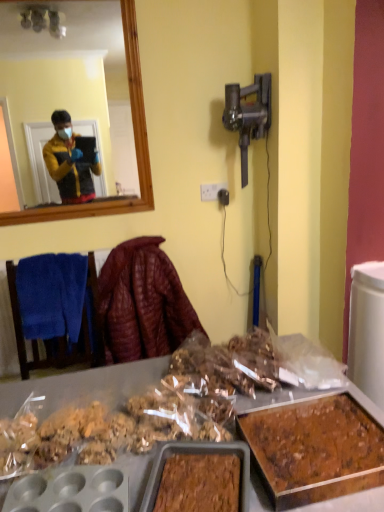
Question: From the image's perspective, is white plastic power outlet at center above or below leather-like maroon jacket at center?

Choices:
 (A) below
 (B) above

Answer: (B)

Question: Is point (215, 190) positioned closer to the camera than point (150, 296)?

Choices:
 (A) closer
 (B) farther

Answer: (B)

Question: Estimate the real-world distances between objects in this image. Which object is farther from the blue towel at left?

Choices:
 (A) brown crumbly cake at lower right
 (B) leather-like maroon jacket at center
 (C) white plastic power outlet at center

Answer: (A)

Question: Estimate the real-world distances between objects in this image. Which object is closer to the leather-like maroon jacket at center?

Choices:
 (A) white plastic power outlet at center
 (B) brown crumbly cake at lower right
 (C) blue towel at left

Answer: (C)